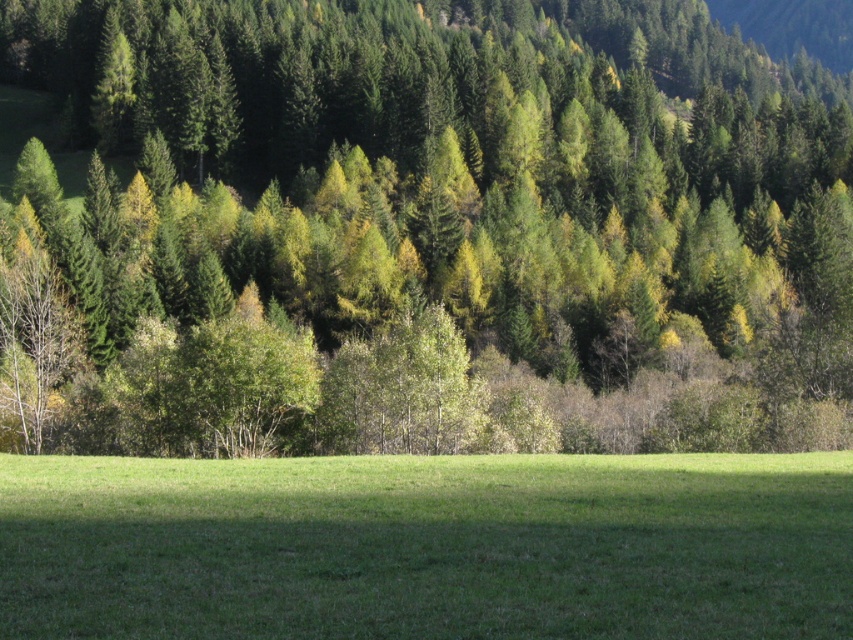
Is green matte tree at upper center thinner than green grassy field at center?

No, green matte tree at upper center is not thinner than green grassy field at center.

Between point (108, 92) and point (589, 490), which one is positioned behind?

Positioned behind is point (108, 92).

Who is more forward, [257,93] or [369,500]?

Point [369,500]

Where is `green matte tree at upper center`? The height and width of the screenshot is (640, 853). green matte tree at upper center is located at coordinates pyautogui.click(x=440, y=221).